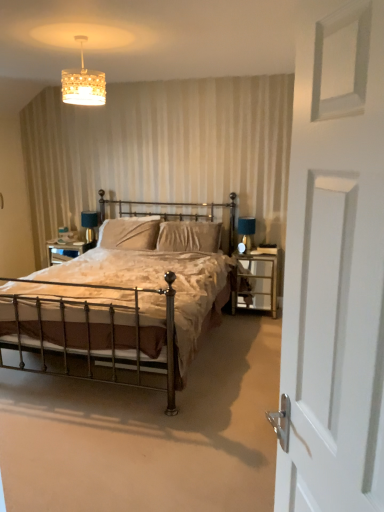
Question: Which is correct: bronze metal bed at center is inside metal/glass nightstand at right, or outside of it?

Choices:
 (A) outside
 (B) inside

Answer: (A)

Question: Considering the positions of point (19, 360) and point (276, 250), is point (19, 360) closer or farther from the camera than point (276, 250)?

Choices:
 (A) closer
 (B) farther

Answer: (A)

Question: Based on their relative distances, which object is nearer to the metal/glass nightstand at right?

Choices:
 (A) velvet beige pillow at center, placed as the 1th pillow when sorted from right to left
 (B) matte blue glass table lamp at right
 (C) white matte door at right
 (D) bronze metal bed at center
 (E) crystalline glass chandelier at upper center

Answer: (B)

Question: Which is nearer to the white matte door at right?

Choices:
 (A) metal/glass nightstand at right
 (B) matte blue glass table lamp at right
 (C) velvet beige pillow at center, arranged as the first pillow when viewed from the left
 (D) bronze metal bed at center
 (E) crystalline glass chandelier at upper center

Answer: (D)